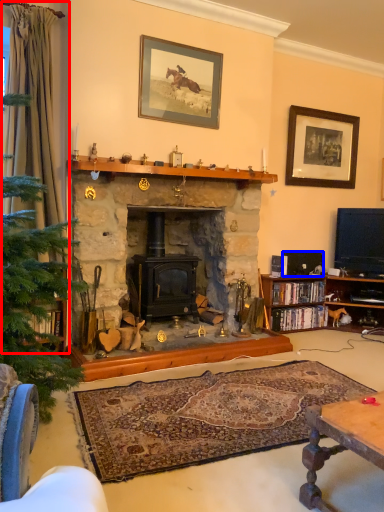
Question: Which of the following is the farthest to the observer, curtain (highlighted by a red box) or corded phone (highlighted by a blue box)?

Choices:
 (A) curtain
 (B) corded phone

Answer: (B)